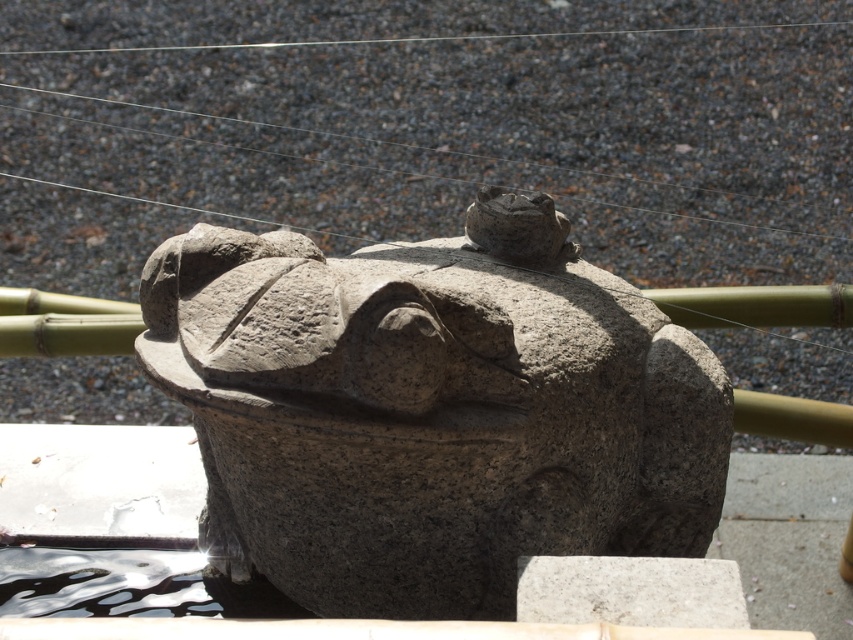
Question: Is granite statue at center below gray granite stone at center?

Choices:
 (A) yes
 (B) no

Answer: (B)

Question: Considering the relative positions of granite statue at center and gray granite stone at center in the image provided, where is granite statue at center located with respect to gray granite stone at center?

Choices:
 (A) below
 (B) above

Answer: (B)

Question: Does granite statue at center have a greater width compared to gray granite stone at center?

Choices:
 (A) no
 (B) yes

Answer: (B)